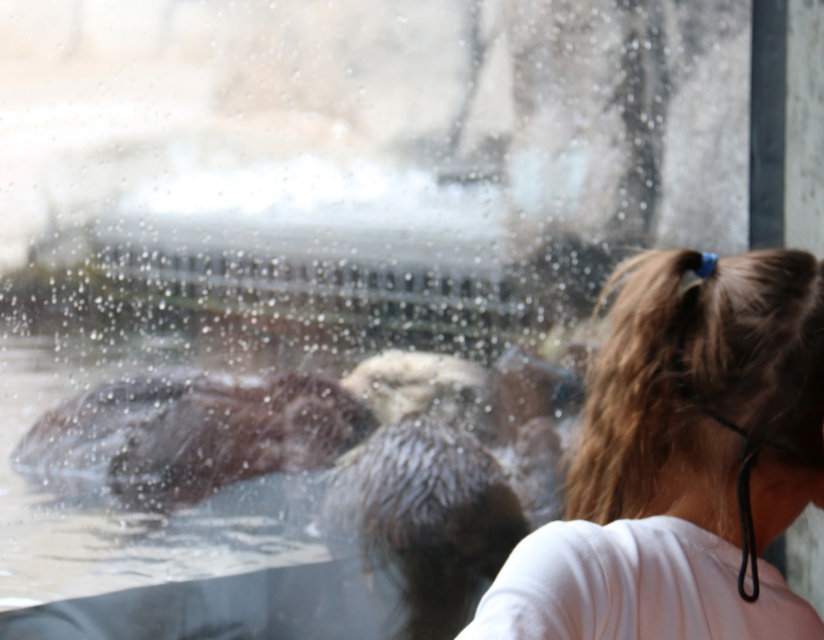
Can you confirm if blonde hair at upper right is positioned to the right of brown fuzzy otter at lower left?

Yes, blonde hair at upper right is to the right of brown fuzzy otter at lower left.

Between blonde hair at upper right and brown fuzzy otter at lower left, which one appears on the left side from the viewer's perspective?

brown fuzzy otter at lower left is more to the left.

Who is more forward, (723, 298) or (148, 502)?

Positioned in front is point (723, 298).

Find the location of `blonde hair at upper right`. blonde hair at upper right is located at coordinates (682, 460).